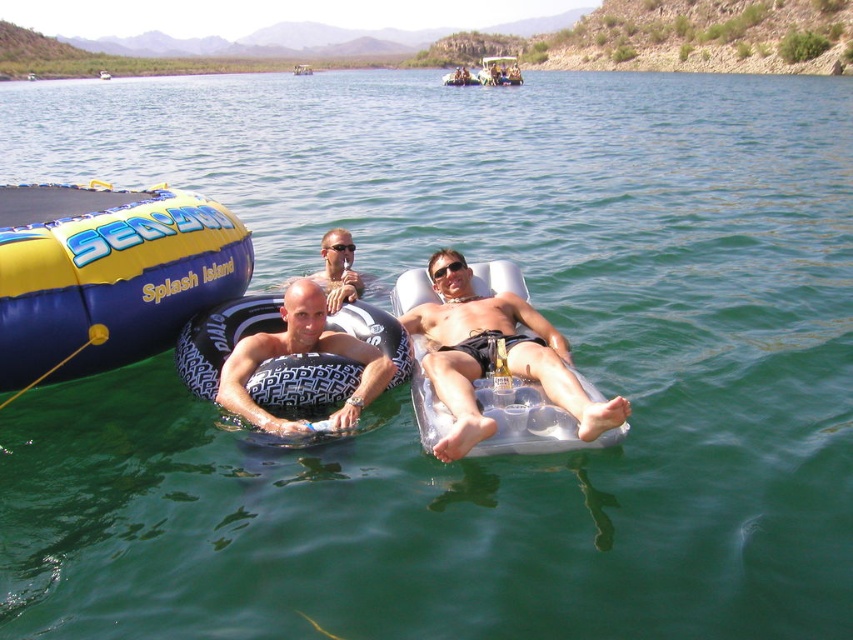
Who is taller, yellow/inflatable boat at left or metallic silver raft at center?

Standing taller between the two is metallic silver raft at center.

Can you confirm if yellow/inflatable boat at left is shorter than metallic silver raft at center?

Yes, yellow/inflatable boat at left is shorter than metallic silver raft at center.

What do you see at coordinates (107, 275) in the screenshot? This screenshot has width=853, height=640. I see `yellow/inflatable boat at left` at bounding box center [107, 275].

Identify the location of yellow/inflatable boat at left. This screenshot has height=640, width=853. (107, 275).

Does point (346, 246) come behind point (109, 74)?

No, (346, 246) is in front of (109, 74).

Is black plastic goggles at center further to camera compared to blue inflatable raft at center?

No.

The width and height of the screenshot is (853, 640). I want to click on black plastic goggles at center, so click(x=339, y=246).

Between point (93, 248) and point (331, 250), which one is positioned in front?

Point (93, 248) is in front.

Is point (80, 365) positioned behind point (341, 241)?

That is False.

You are a GUI agent. You are given a task and a screenshot of the screen. Output one action in this format:
    pyautogui.click(x=<x>, y=<y>)
    Task: Click on the yellow/inflatable boat at left
    
    Given the screenshot: What is the action you would take?
    pyautogui.click(x=107, y=275)